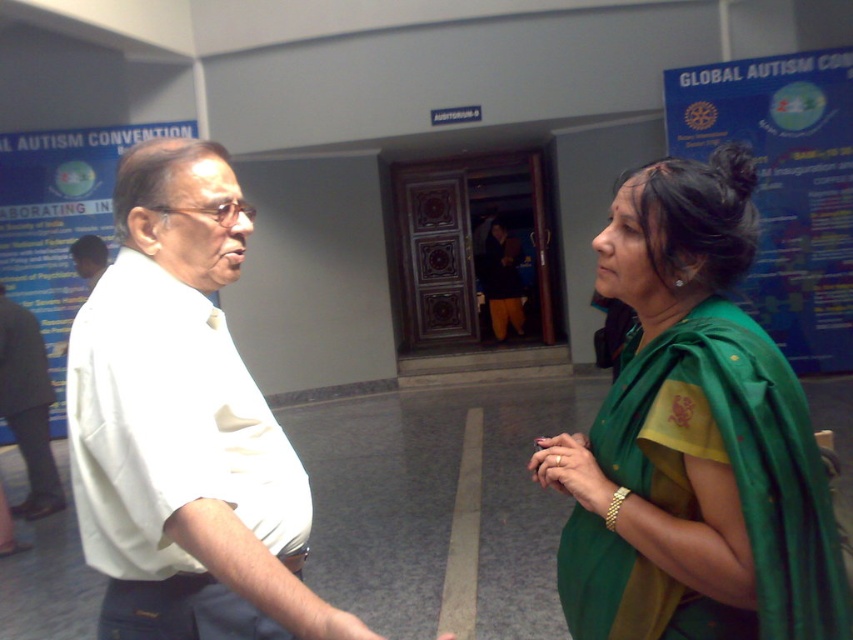
Who is more distant from viewer, (161,627) or (103,269)?

The point (103,269) is more distant.

Is white shirt at center to the right of matte white shirt at center from the viewer's perspective?

Indeed, white shirt at center is positioned on the right side of matte white shirt at center.

Is point (325, 616) more distant than point (97, 241)?

No, (325, 616) is in front of (97, 241).

Locate an element on the screen. This screenshot has height=640, width=853. white shirt at center is located at coordinates (184, 426).

Can you confirm if green silk saree at center is positioned below white shirt at center?

Indeed, green silk saree at center is positioned under white shirt at center.

Is green silk saree at center smaller than white shirt at center?

Yes.

Is point (706, 205) closer to camera compared to point (91, 381)?

No, (706, 205) is behind (91, 381).

I want to click on green silk saree at center, so click(693, 438).

How much distance is there between green silk saree at center and matte white shirt at center?

4.48 meters

Does point (585, 621) lie in front of point (94, 259)?

That is True.

At what (x,y) coordinates should I click in order to perform the action: click on green silk saree at center. Please return your answer as a coordinate pair (x, y). The width and height of the screenshot is (853, 640). Looking at the image, I should click on (693, 438).